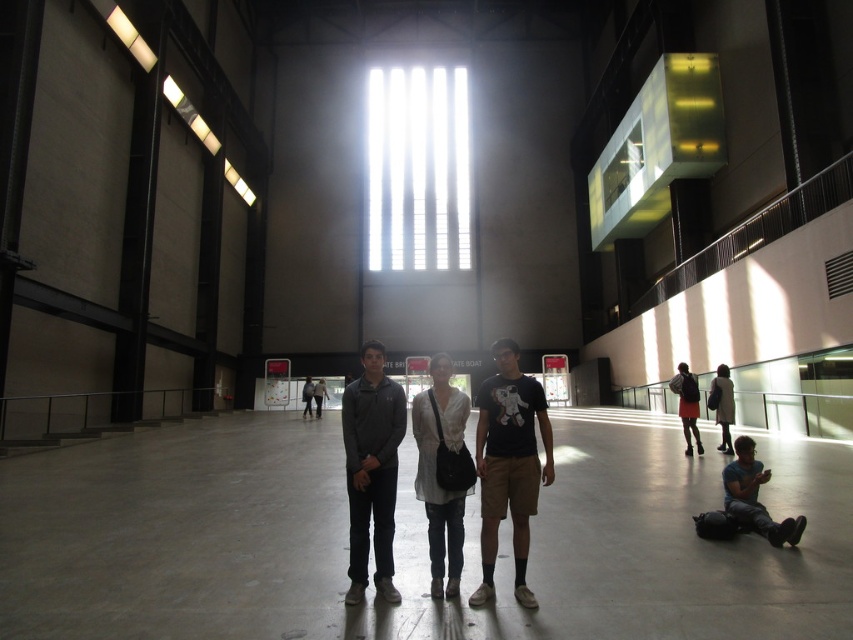
Is light gray cotton blouse at center smaller than white cotton jacket at lower right?

Indeed, light gray cotton blouse at center has a smaller size compared to white cotton jacket at lower right.

Can you confirm if light gray cotton blouse at center is shorter than white cotton jacket at lower right?

Yes, light gray cotton blouse at center is shorter than white cotton jacket at lower right.

Describe the element at coordinates (436, 502) in the screenshot. I see `light gray cotton blouse at center` at that location.

The image size is (853, 640). What are the coordinates of `light gray cotton blouse at center` in the screenshot? It's located at click(436, 502).

Which is above, matte black jacket at center or white cotton jacket at lower right?

matte black jacket at center is above.

Is matte black jacket at center below white cotton jacket at lower right?

No.

Which is in front, point (387, 568) or point (720, 384)?

Point (387, 568)

Identify the location of matte black jacket at center. click(437, 474).

Which is below, blue denim jeans at lower right or orange skirt at center?

blue denim jeans at lower right

Is blue denim jeans at lower right bigger than orange skirt at center?

No, blue denim jeans at lower right is not bigger than orange skirt at center.

Who is more forward, (740, 465) or (691, 376)?

Point (740, 465)

Find the location of `blue denim jeans at lower right`. blue denim jeans at lower right is located at coordinates (753, 497).